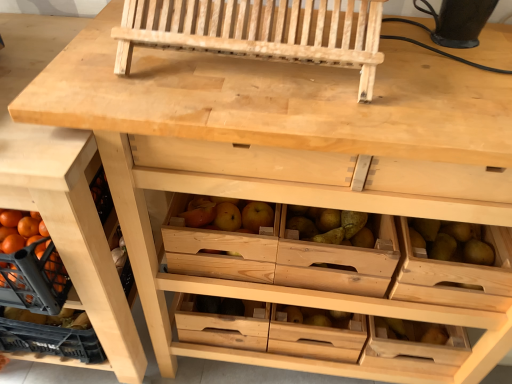
Question: From a real-world perspective, is natural wood church bench at upper center over wooden drawer at center, positioned as the second drawer in top-to-bottom order?

Choices:
 (A) yes
 (B) no

Answer: (A)

Question: Is natural wood church bench at upper center beside wooden drawer at center, arranged as the first drawer when viewed from the back?

Choices:
 (A) no
 (B) yes

Answer: (A)

Question: Considering the relative sizes of natural wood church bench at upper center and wooden drawer at center, the second drawer in the front-to-back sequence, in the image provided, is natural wood church bench at upper center wider than wooden drawer at center, the second drawer in the front-to-back sequence,?

Choices:
 (A) no
 (B) yes

Answer: (B)

Question: Is natural wood church bench at upper center not inside wooden drawer at center, the second drawer in the front-to-back sequence?

Choices:
 (A) yes
 (B) no

Answer: (A)

Question: Is natural wood church bench at upper center thinner than wooden drawer at center, which is the first drawer in bottom-to-top order?

Choices:
 (A) yes
 (B) no

Answer: (B)

Question: Is natural wood drawer at lower left wider or thinner than wooden drawer at right, acting as the second drawer starting from the back?

Choices:
 (A) thin
 (B) wide

Answer: (B)

Question: Is natural wood drawer at lower left inside the boundaries of wooden drawer at right, the first drawer when ordered from front to back, or outside?

Choices:
 (A) outside
 (B) inside

Answer: (A)

Question: From the image's perspective, is natural wood drawer at lower left above or below wooden drawer at right, the second drawer viewed from the left?

Choices:
 (A) above
 (B) below

Answer: (A)

Question: In terms of height, does natural wood drawer at lower left look taller or shorter compared to wooden drawer at right, which ranks as the 1th drawer in right-to-left order?

Choices:
 (A) tall
 (B) short

Answer: (A)

Question: From a real-world perspective, is natural wood church bench at upper center above or below natural wood drawer at lower left?

Choices:
 (A) below
 (B) above

Answer: (B)

Question: From the image's perspective, is natural wood church bench at upper center above or below natural wood drawer at lower left?

Choices:
 (A) above
 (B) below

Answer: (A)

Question: Is natural wood church bench at upper center wider or thinner than natural wood drawer at lower left?

Choices:
 (A) wide
 (B) thin

Answer: (B)

Question: Is natural wood church bench at upper center situated inside natural wood drawer at lower left or outside?

Choices:
 (A) inside
 (B) outside

Answer: (B)

Question: From a real-world perspective, is natural wood drawer at lower left physically located above or below wooden drawer at center, arranged as the first drawer when viewed from the back?

Choices:
 (A) above
 (B) below

Answer: (A)

Question: Is natural wood drawer at lower left to the left or to the right of wooden drawer at center, which is the first drawer in bottom-to-top order, in the image?

Choices:
 (A) right
 (B) left

Answer: (B)